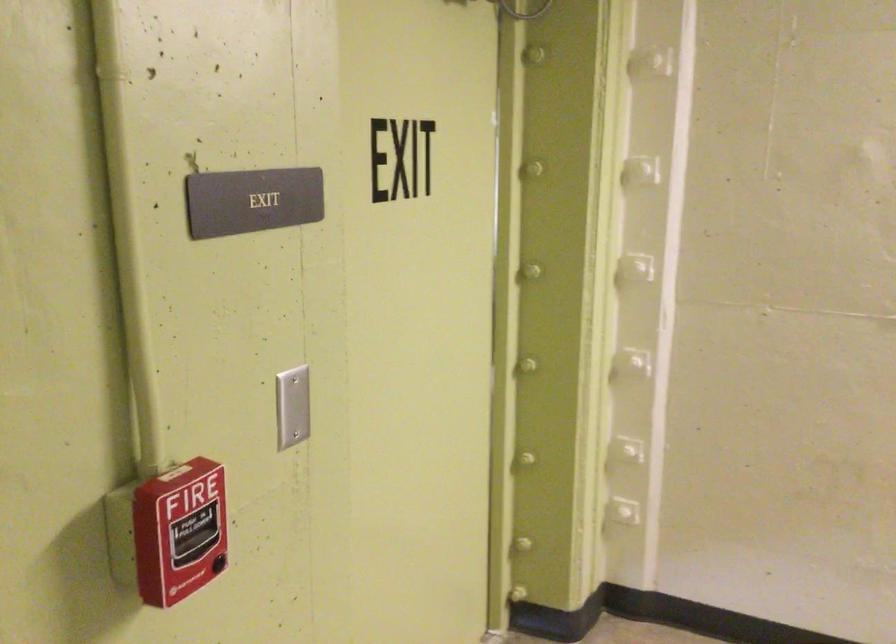
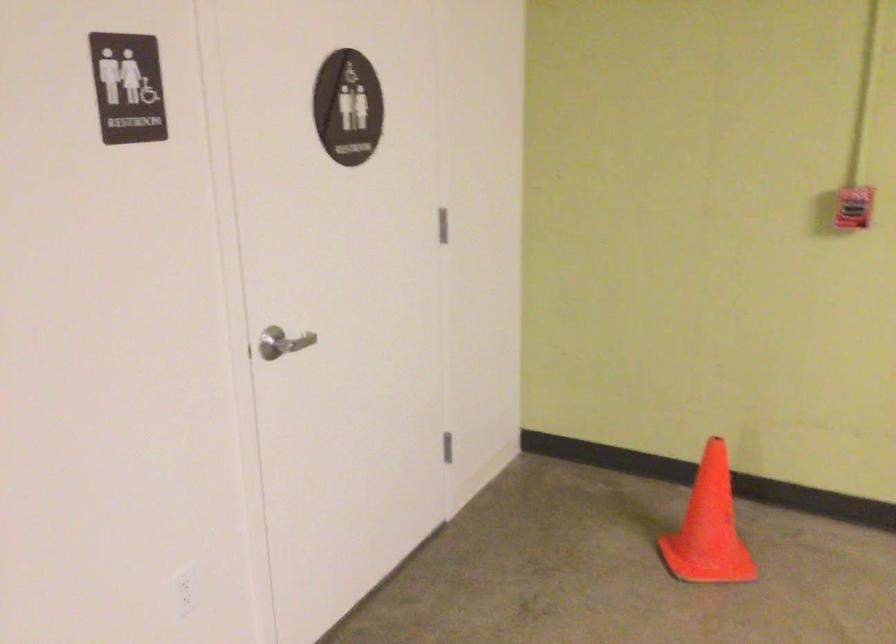
Where in the second image is the point corresponding to pixel 201 484 from the first image?

(854, 207)